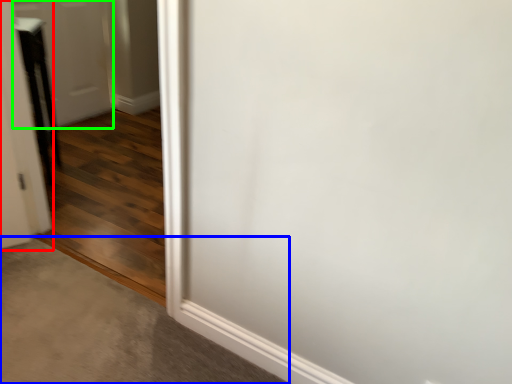
Question: Based on their relative distances, which object is nearer to door (highlighted by a red box)? Choose from concrete (highlighted by a blue box) and door (highlighted by a green box).

Choices:
 (A) concrete
 (B) door

Answer: (A)